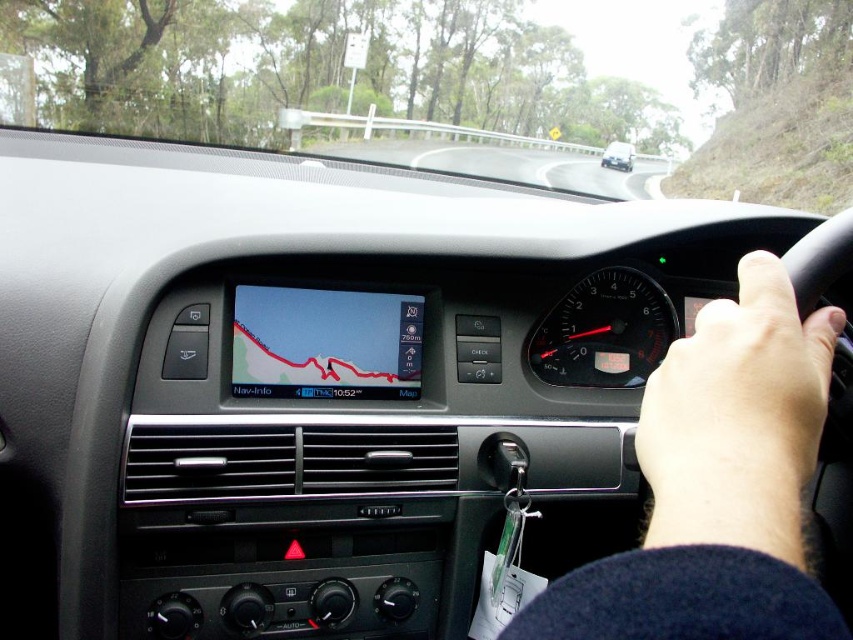
You are a passenger in the car and want to point out two specific points on the dashboard. The first point is at coordinates point [566,637] and the second is at point [730,353]. Which of these two points is physically closer to your eyes?

Point [566,637] is closer to the camera than point [730,353], so the first point is closer to your eyes.

You are a driver who just noticed two hands near the steering wheel. You need to determine if there is enough space between them to safely place a small GPS device. The GPS device is 1.2 centimeters thick. Can you fit it between the smooth skin hand at center right and the skinny white hand at center right?

The distance between the smooth skin hand at center right and the skinny white hand at center right is 1.23 centimeters. Since the GPS device is 1.2 centimeters thick, there is just enough space to fit it between them.